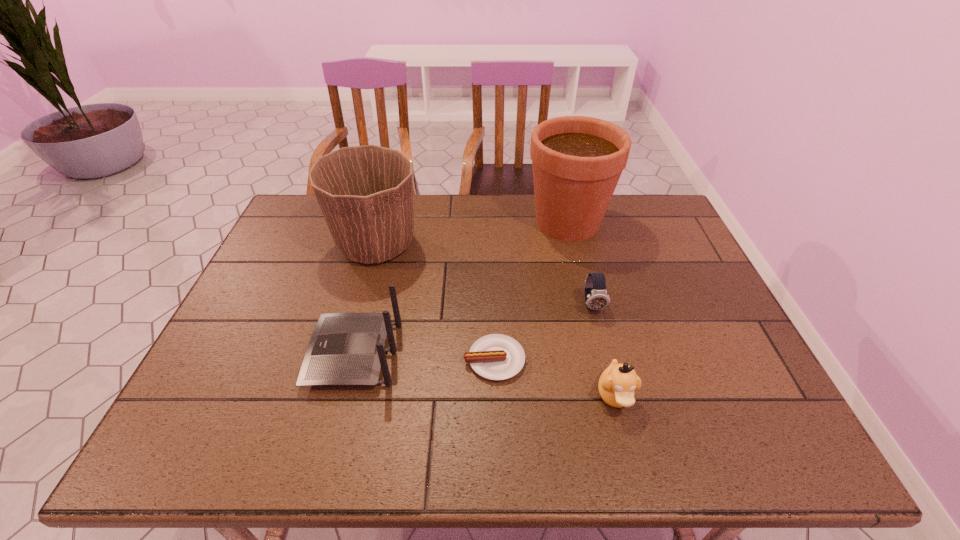
Identify which object is located as the fourth nearest to the third tallest object. Please provide its 2D coordinates. Your answer should be formatted as a tuple, i.e. [(x, y)], where the tuple contains the x and y coordinates of a point satisfying the conditions above.

[(617, 384)]

Locate an element on the screen. object identified as the third closest to the left flowerpot is located at coordinates (577, 161).

The image size is (960, 540). Identify the location of vacant space that satisfies the following two spatial constraints: 1. on the face of the third farthest object; 2. on the front-facing side of the fourth shortest object. (605, 354).

Find the location of a particular element. The width and height of the screenshot is (960, 540). vacant region that satisfies the following two spatial constraints: 1. on the face of the watch; 2. on the front-facing side of the router is located at coordinates (605, 354).